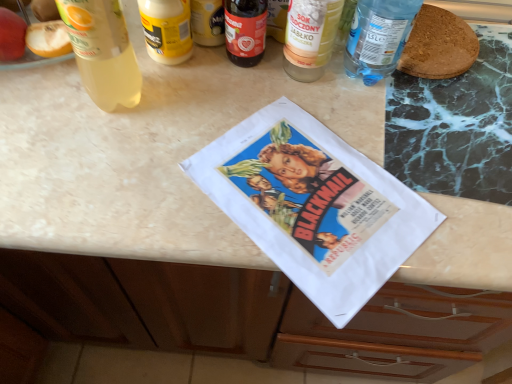
Question: In terms of width, does yellow matte jar at upper center, marked as the second bottle in a left-to-right arrangement, look wider or thinner when compared to transparent plastic bottle at upper right, the 1th bottle in the right-to-left sequence?

Choices:
 (A) thin
 (B) wide

Answer: (A)

Question: Considering the positions of yellow matte jar at upper center, marked as the second bottle in a left-to-right arrangement, and transparent plastic bottle at upper right, the 5th bottle in the left-to-right sequence, in the image, is yellow matte jar at upper center, marked as the second bottle in a left-to-right arrangement, bigger or smaller than transparent plastic bottle at upper right, the 5th bottle in the left-to-right sequence,?

Choices:
 (A) small
 (B) big

Answer: (A)

Question: Which is nearer to the dark red glass bottle at center, the third bottle from the left?

Choices:
 (A) translucent glass bottle at upper center, which is counted as the 2th bottle, starting from the right
 (B) translucent plastic bottle at upper left, which is counted as the fifth bottle, starting from the right
 (C) yellow matte jar at upper center, marked as the second bottle in a left-to-right arrangement
 (D) transparent plastic bottle at upper right, the 1th bottle in the right-to-left sequence

Answer: (A)

Question: Which object is positioned farthest from the transparent plastic bottle at upper right, the 1th bottle in the right-to-left sequence?

Choices:
 (A) translucent glass bottle at upper center, which is counted as the 2th bottle, starting from the right
 (B) yellow matte jar at upper center, the fourth bottle from the right
 (C) translucent plastic bottle at upper left, which is counted as the fifth bottle, starting from the right
 (D) dark red glass bottle at center, arranged as the third bottle when viewed from the right

Answer: (C)